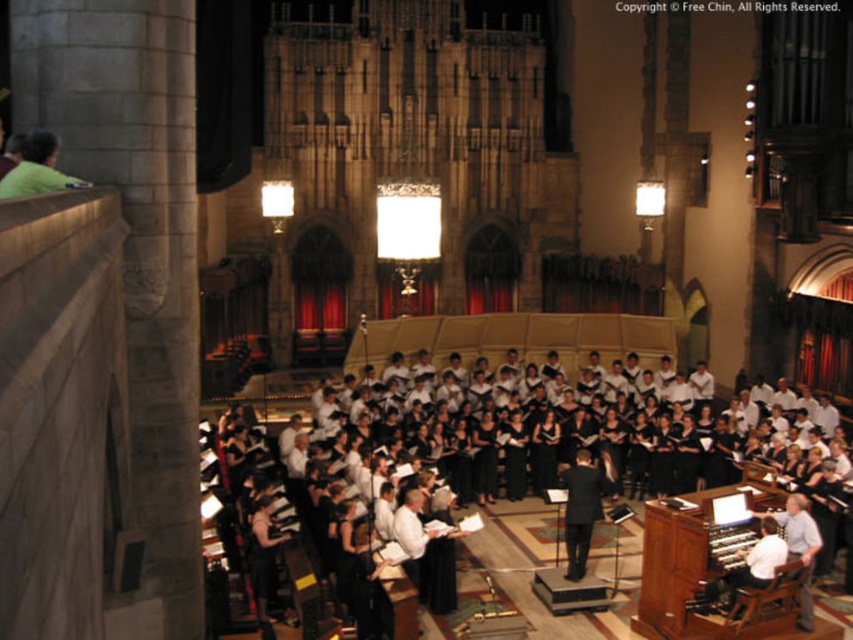
Question: Is black fabric choir at center wider than white fabric shirt at lower right?

Choices:
 (A) yes
 (B) no

Answer: (A)

Question: Estimate the real-world distances between objects in this image. Which object is farther from the black fabric choir at center?

Choices:
 (A) white fabric shirt at lower right
 (B) black suit at center

Answer: (A)

Question: Does black fabric choir at center appear over black suit at center?

Choices:
 (A) yes
 (B) no

Answer: (B)

Question: Can you confirm if black suit at center is positioned to the right of white fabric shirt at lower right?

Choices:
 (A) yes
 (B) no

Answer: (B)

Question: Which object appears closest to the camera in this image?

Choices:
 (A) black suit at center
 (B) white fabric shirt at lower right
 (C) black fabric choir at center
 (D) green matte shirt at upper left

Answer: (D)

Question: Among these objects, which one is nearest to the camera?

Choices:
 (A) white fabric shirt at lower right
 (B) green matte shirt at upper left
 (C) black suit at center
 (D) black fabric choir at center

Answer: (B)